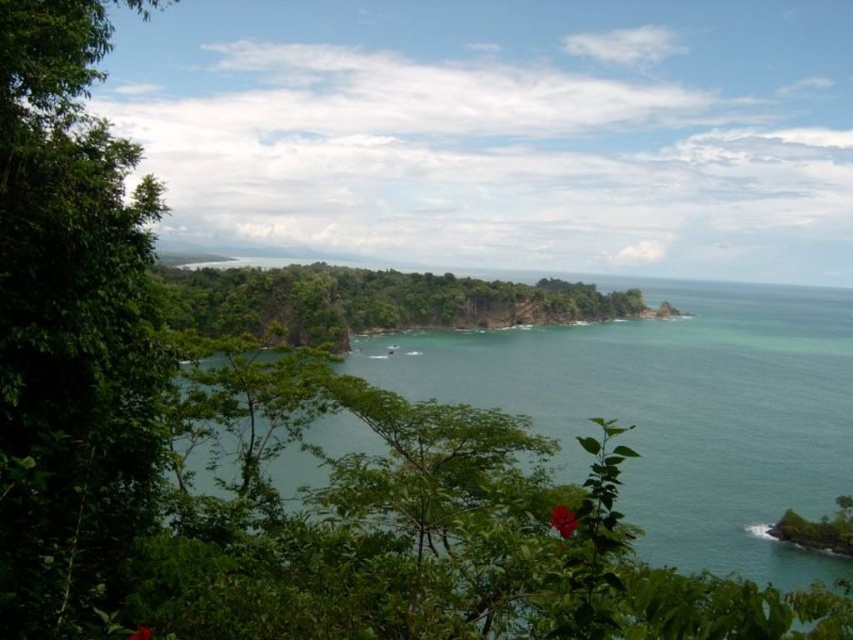
You are standing in the coastal landscape and want to take a photo of the green leafy tree at left and the green glossy water at center. Which object should you position to your right side to capture both in the frame?

You should position the green glossy water at center to your right side since the green leafy tree at left is to the left of it, allowing both to be captured in the frame.

You are an artist trying to paint the coastal landscape. You want to ensure the green leafy tree at left and the green leafy forest at center are proportionally accurate. Which of the two should you draw with a narrower width in your painting?

The green leafy tree at left should be drawn with a narrower width because it is thinner than the green leafy forest at center.

You are standing in the coastal landscape scene and want to take a photo of the green leafy tree at left. According to the scene description, where should you position yourself to capture the tree in the frame?

The green leafy tree at left is located at the 2D coordinates point (68, 320), so you should position yourself facing the left side of the scene to capture it in the frame.